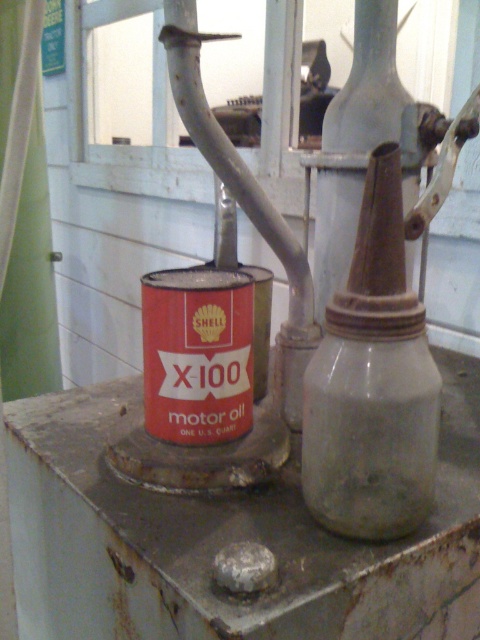
You are an engineer inspecting a workshop. You see a matte gray oil canister at center and a rusty metal oil canister at center. Which one has a smaller height?

The matte gray oil canister at center is shorter than the rusty metal oil canister at center, so the matte gray oil canister at center has a smaller height.

You are working on an old engine and need to locate the oil canisters. According to the image, which direction should you look from the matte gray oil canister at center to find the rusty metal oil canister at center?

You should look to the right from the matte gray oil canister at center to find the rusty metal oil canister at center since the matte gray oil canister at center is to the left of the rusty metal oil canister at center.